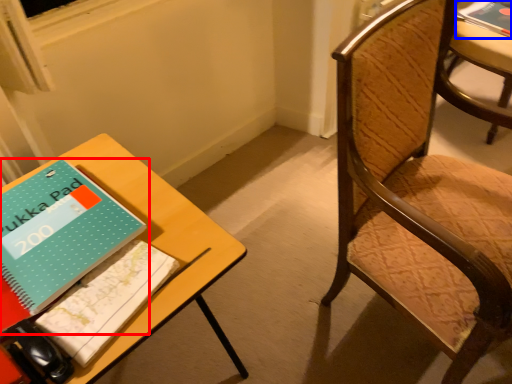
Question: Which of the following is the farthest to the observer, book (highlighted by a red box) or book (highlighted by a blue box)?

Choices:
 (A) book
 (B) book

Answer: (B)